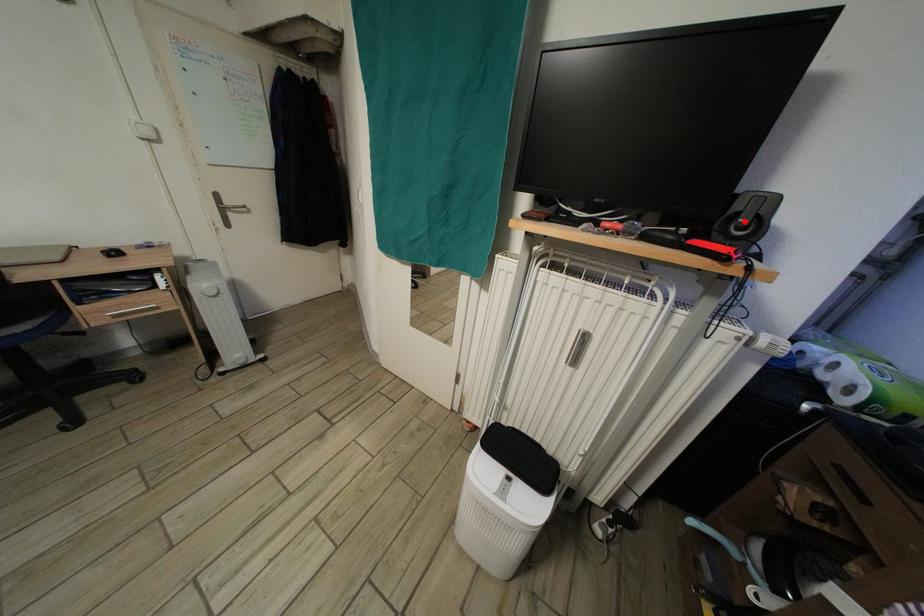
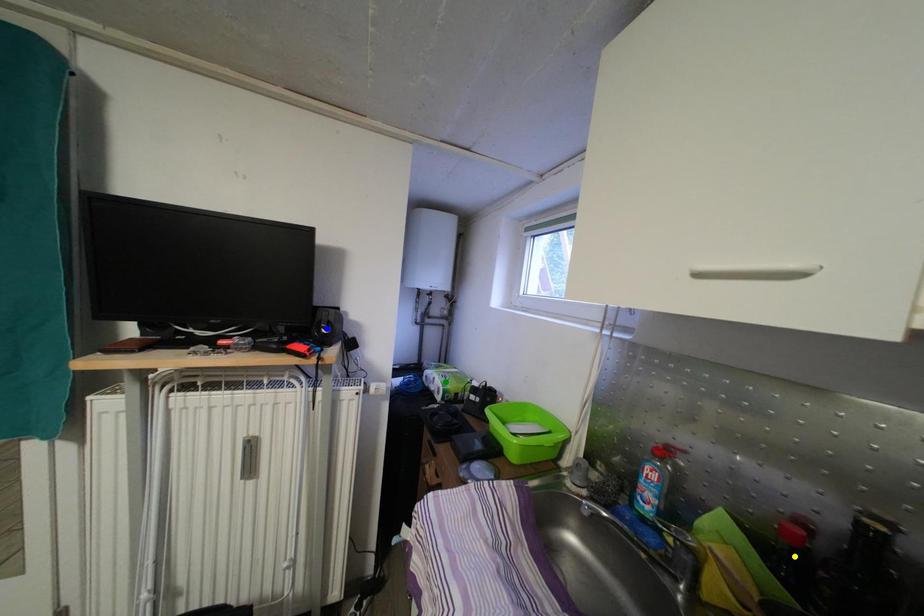
Question: I am providing you with two images of the same scene from different viewpoints. A red point is marked on the first image. You are given multiple points on the second image. Which point in image 2 is actually the same real-world point as the red point in image 1?

Choices:
 (A) yellow point
 (B) green point
 (C) blue point

Answer: (C)